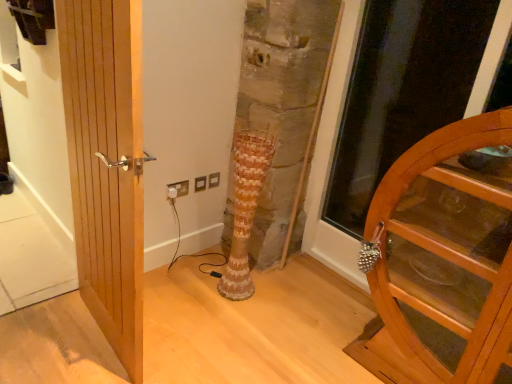
Find the location of a particular element. vacant point to the right of natural wood door at left, which is the first door from left to right is located at coordinates (198, 337).